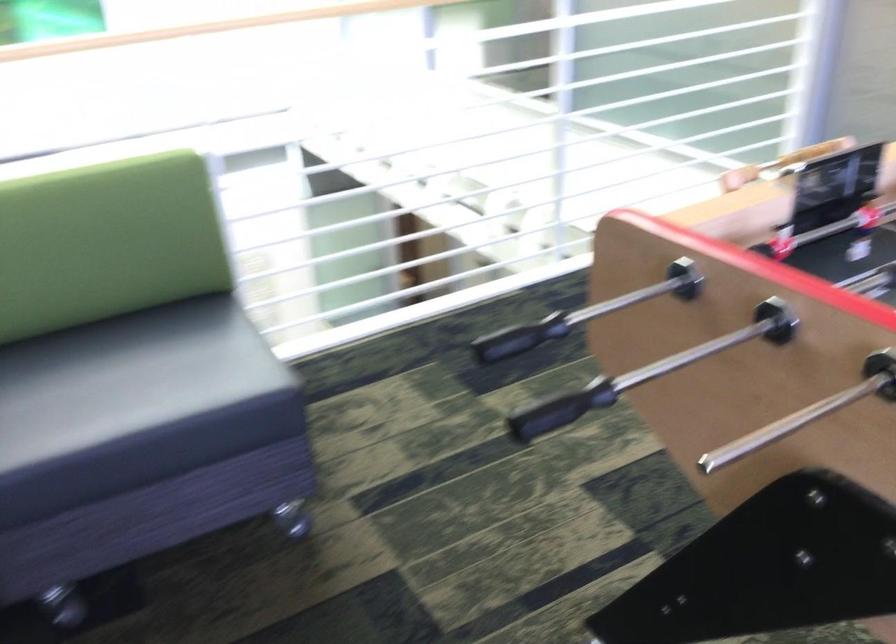
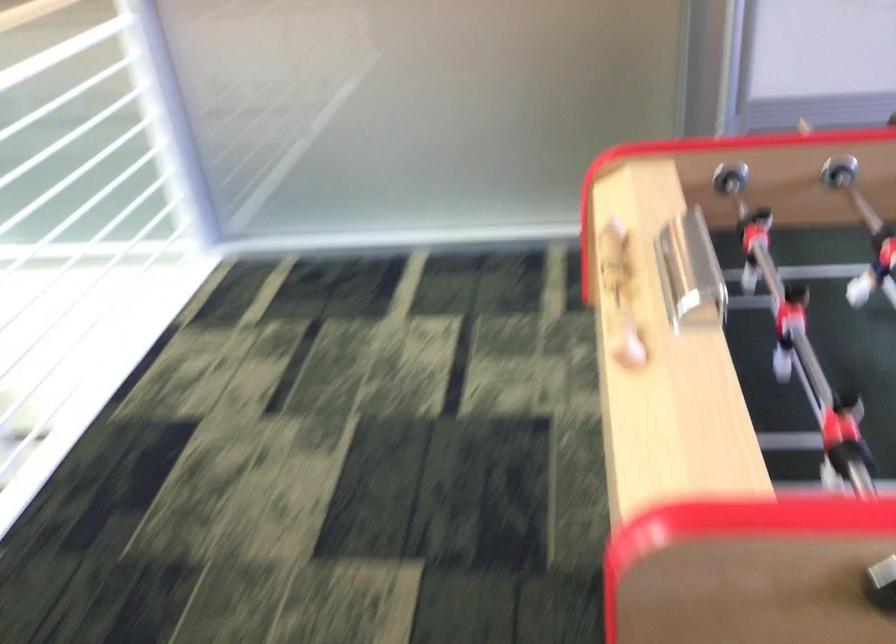
Find the pixel in the second image that matches point (815, 149) in the first image.

(614, 254)